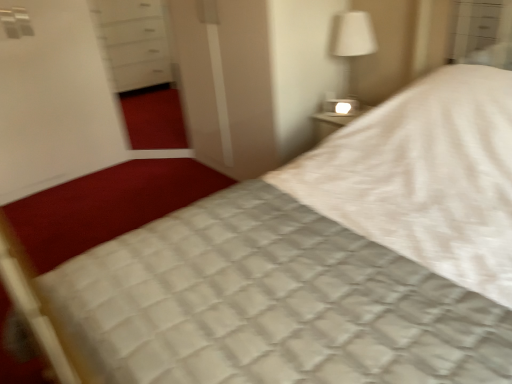
Question: Should I look upward or downward to see white fabric lampshade at upper right?

Choices:
 (A) down
 (B) up

Answer: (B)

Question: From the image's perspective, is white fabric lampshade at upper right beneath transparent glass screen door at center, the 2th screen door from the left?

Choices:
 (A) yes
 (B) no

Answer: (B)

Question: From the image's perspective, is white fabric lampshade at upper right on top of transparent glass screen door at center, the 2th screen door from the left?

Choices:
 (A) no
 (B) yes

Answer: (B)

Question: Is white fabric lampshade at upper right directly adjacent to transparent glass screen door at center, the 2th screen door from the left?

Choices:
 (A) yes
 (B) no

Answer: (B)

Question: Considering the relative sizes of white fabric lampshade at upper right and transparent glass screen door at center, the 2th screen door from the left, in the image provided, is white fabric lampshade at upper right taller than transparent glass screen door at center, the 2th screen door from the left,?

Choices:
 (A) yes
 (B) no

Answer: (B)

Question: Considering the relative sizes of white fabric lampshade at upper right and transparent glass screen door at center, the 2th screen door from the left, in the image provided, is white fabric lampshade at upper right bigger than transparent glass screen door at center, the 2th screen door from the left,?

Choices:
 (A) yes
 (B) no

Answer: (B)

Question: From a real-world perspective, is white fabric lampshade at upper right positioned over transparent glass screen door at center, which is the first screen door in right-to-left order, based on gravity?

Choices:
 (A) yes
 (B) no

Answer: (A)

Question: From the image's perspective, is transparent glass screen door at center, the 2th screen door from the left, located beneath white fabric lampshade at upper right?

Choices:
 (A) no
 (B) yes

Answer: (B)

Question: Is transparent glass screen door at center, which is the first screen door in right-to-left order, outside of white fabric lampshade at upper right?

Choices:
 (A) yes
 (B) no

Answer: (A)

Question: Does transparent glass screen door at center, the 2th screen door from the left, contain white fabric lampshade at upper right?

Choices:
 (A) yes
 (B) no

Answer: (B)

Question: Is transparent glass screen door at center, which is the first screen door in right-to-left order, next to white fabric lampshade at upper right?

Choices:
 (A) no
 (B) yes

Answer: (A)

Question: Does transparent glass screen door at center, which is the first screen door in right-to-left order, come behind white fabric lampshade at upper right?

Choices:
 (A) yes
 (B) no

Answer: (B)

Question: From a real-world perspective, is transparent glass screen door at center, the 2th screen door from the left, on white fabric lampshade at upper right?

Choices:
 (A) yes
 (B) no

Answer: (B)

Question: Is transparent glass screen door at center, the 2th screen door from the left, at the back of white glossy screen door at upper left, marked as the 2th screen door in a right-to-left arrangement?

Choices:
 (A) yes
 (B) no

Answer: (B)